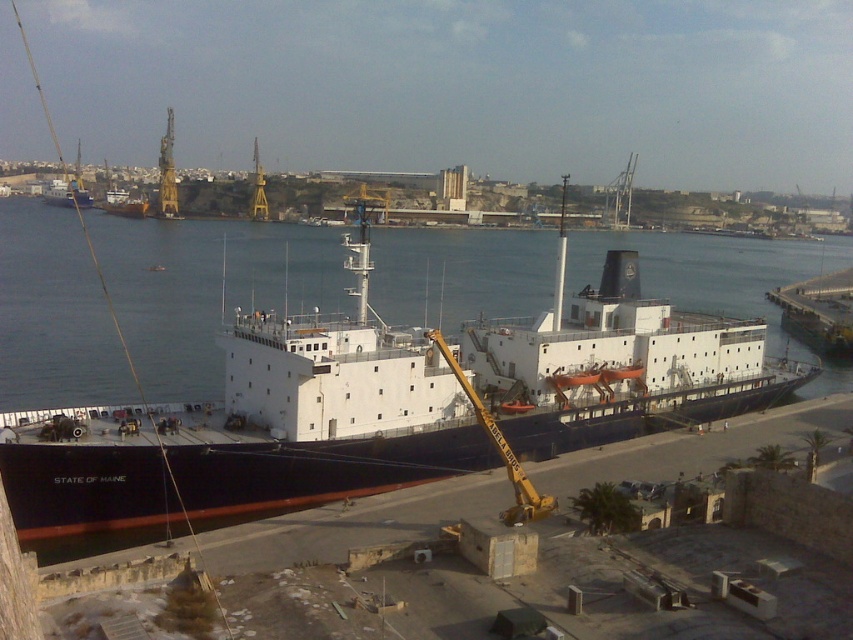
Question: Among these points, which one is farthest from the camera?

Choices:
 (A) (82, 195)
 (B) (184, 461)

Answer: (A)

Question: Which of the following is the closest to the observer?

Choices:
 (A) (183, 422)
 (B) (76, 186)

Answer: (A)

Question: Is black matte ship at center smaller than matte black ship at upper left?

Choices:
 (A) no
 (B) yes

Answer: (A)

Question: Does black matte ship at center have a larger size compared to matte black ship at upper left?

Choices:
 (A) no
 (B) yes

Answer: (B)

Question: Which of the following is the farthest from the observer?

Choices:
 (A) (71, 200)
 (B) (781, 388)

Answer: (A)

Question: Can you confirm if black matte ship at center is positioned below matte black ship at upper left?

Choices:
 (A) no
 (B) yes

Answer: (B)